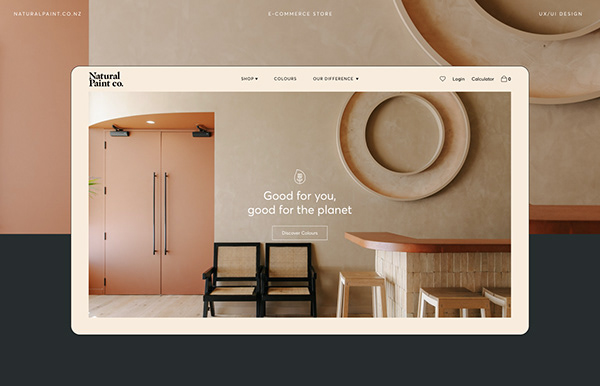
Locate an element on the screen. edges of counter is located at coordinates (433, 268), (394, 263).